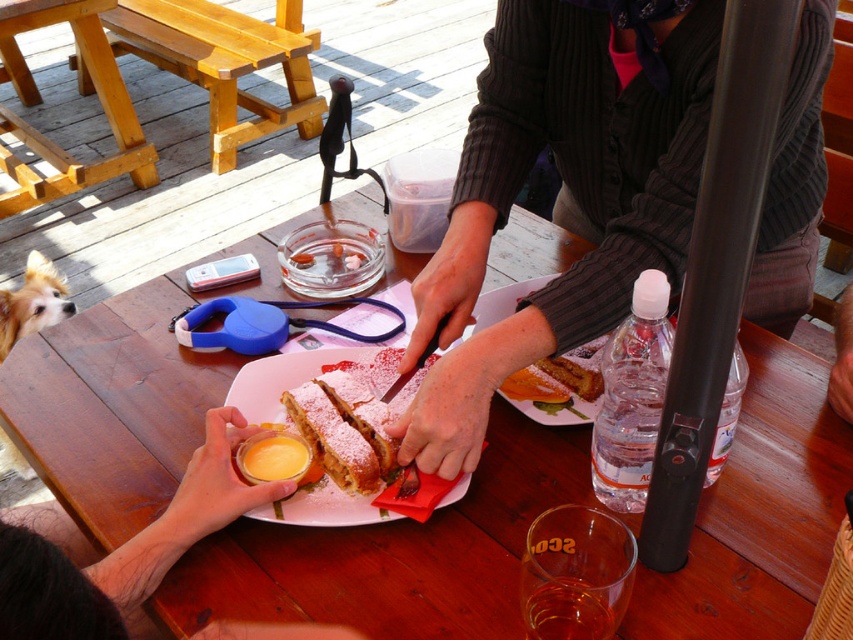
Question: Which is nearer to the fuzzy brown dog at lower left?

Choices:
 (A) brown fur dog at lower left
 (B) powdered sugar pastry at center

Answer: (A)

Question: Is powdered sugar cake at center above brown fur dog at lower left?

Choices:
 (A) yes
 (B) no

Answer: (B)

Question: Considering the real-world distances, which object is farthest from the brown fur dog at lower left?

Choices:
 (A) powdered sugar cake at center
 (B) golden brown cake at center
 (C) powdered sugar pastry at center

Answer: (B)

Question: Considering the real-world distances, which object is farthest from the golden brown cake at center?

Choices:
 (A) smooth yellow cream at lower left
 (B) dark ribbed sweater at center
 (C) fuzzy brown dog at lower left
 (D) wooden table at center

Answer: (C)

Question: Can you confirm if dark ribbed sweater at center is positioned below powdered sugar pastry at center?

Choices:
 (A) yes
 (B) no

Answer: (B)

Question: Is powdered sugar cake at center wider than powdered sugar pastry at center?

Choices:
 (A) no
 (B) yes

Answer: (B)